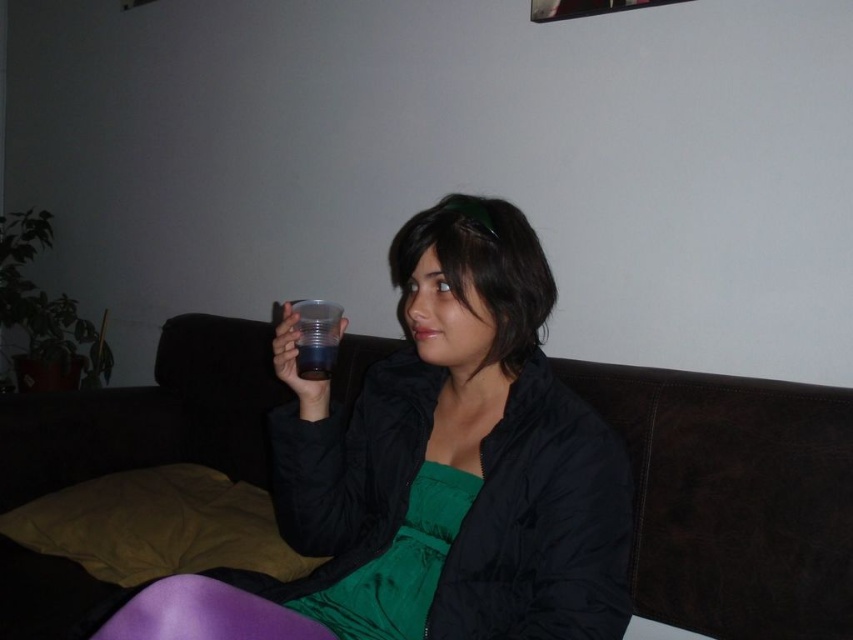
You are a delivery robot that needs to deliver a package to the brown leather couch at center. The package is 2 meters long. Can you place the package on the couch without it hanging off the edge?

The brown leather couch at center is 1.88 meters away from the camera. The distance from the camera to the couch does not indicate the couch length. Therefore, we cannot determine if the 2 meters long package will fit on the couch based on the provided information.

You are a photographer setting up a shoot in the room described. You need to ensure that the brown leather couch at center and the green satin dress at center are both visible in the frame. Based on their positions, can you confirm if both items are within the same line of sight?

The brown leather couch at center is positioned over the green satin dress at center, meaning they are layered in such a way that both can be captured within the same frame as they occupy the same central area.

You are a photographer setting up a shoot in this room. You want to place a small lamp between the brown leather couch at center and the green satin dress at center. Based on their positions, which side of the lamp should face the wall?

The brown leather couch at center is to the left of the green satin dress at center, so the lamp should be placed between them with the side facing the wall positioned towards the brown leather couch at center since it is on the left side.